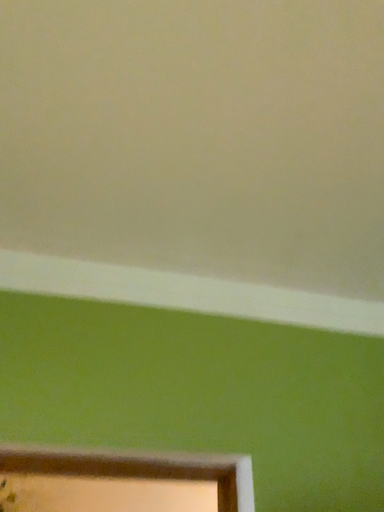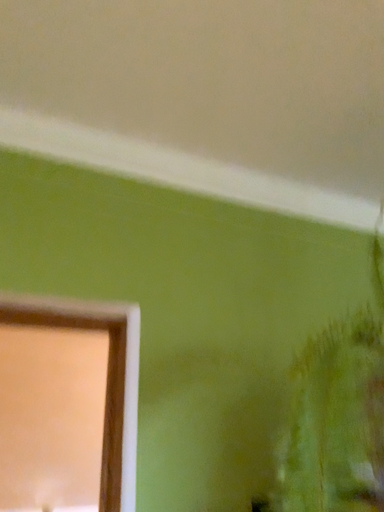
Question: Which way did the camera rotate in the video?

Choices:
 (A) rotated right
 (B) rotated left

Answer: (A)